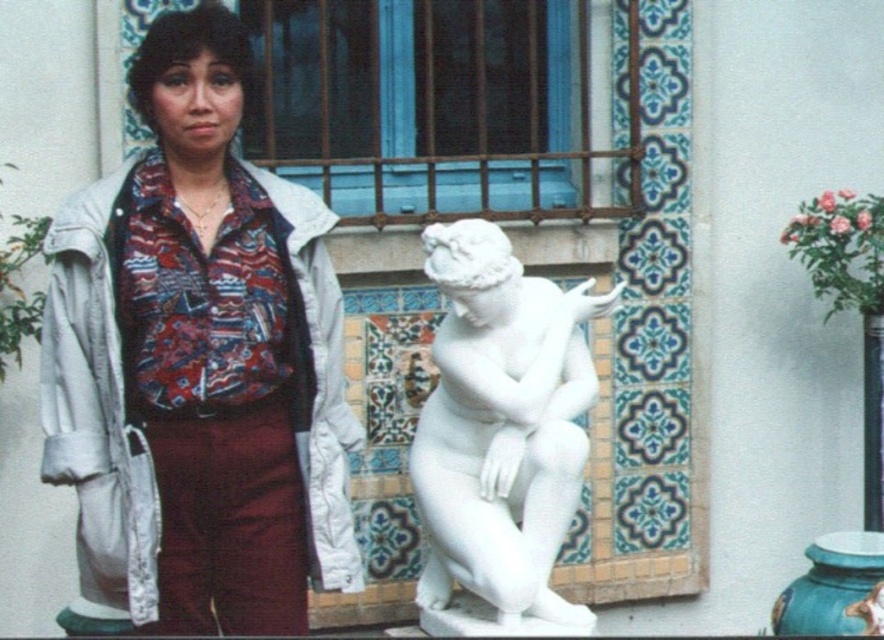
Does point (88, 413) lie behind point (455, 330)?

That is False.

Which is above, matte white blouse at center or white marble statue at center?

matte white blouse at center is above.

Identify the location of matte white blouse at center. The width and height of the screenshot is (884, 640). (197, 365).

Identify the location of matte white blouse at center. Image resolution: width=884 pixels, height=640 pixels. (197, 365).